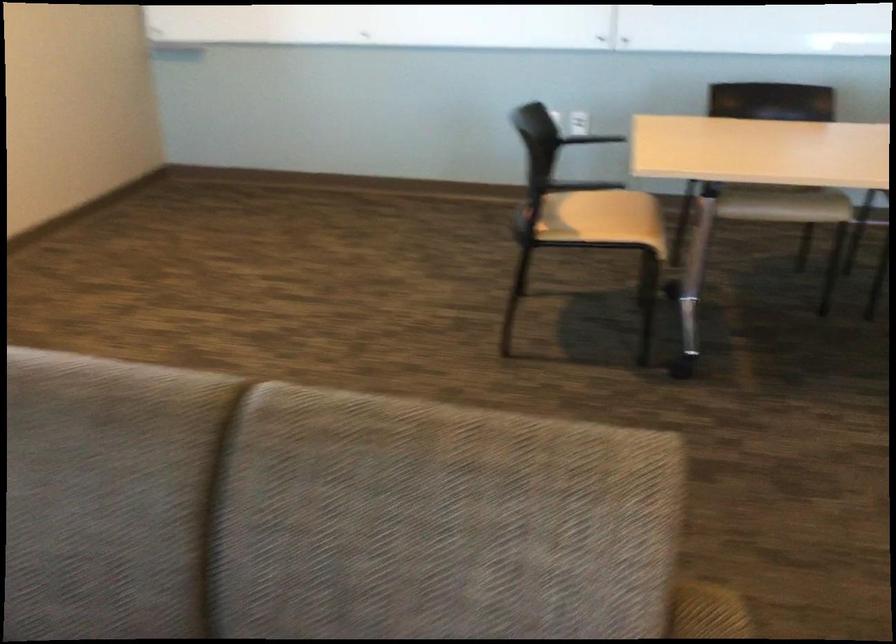
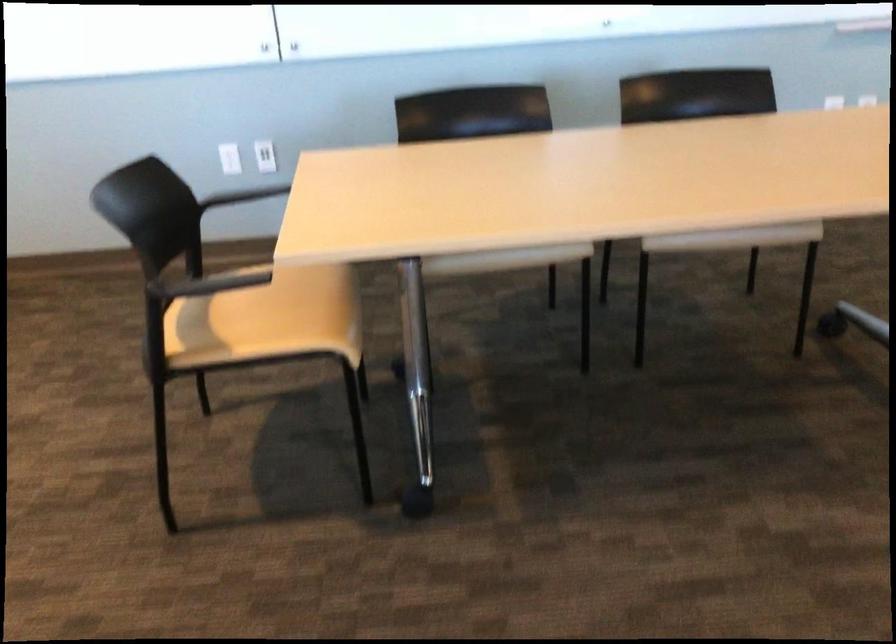
Locate, in the second image, the point that corresponds to the point at 604,218 in the first image.

(274, 315)